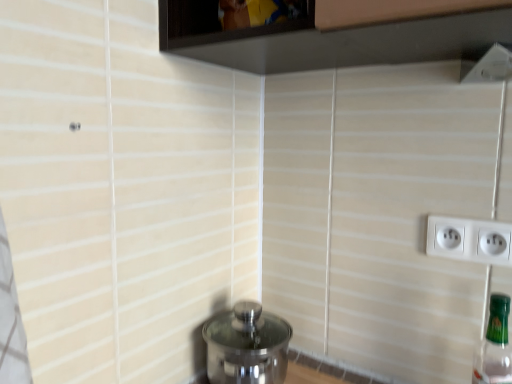
Question: From a real-world perspective, is transparent glass window at upper center beneath green glass bottle at right?

Choices:
 (A) yes
 (B) no

Answer: (B)

Question: Is transparent glass window at upper center wider than green glass bottle at right?

Choices:
 (A) yes
 (B) no

Answer: (A)

Question: Does transparent glass window at upper center appear on the left side of green glass bottle at right?

Choices:
 (A) yes
 (B) no

Answer: (A)

Question: Is transparent glass window at upper center in front of green glass bottle at right?

Choices:
 (A) yes
 (B) no

Answer: (B)

Question: Considering the relative positions of transparent glass window at upper center and green glass bottle at right in the image provided, is transparent glass window at upper center behind green glass bottle at right?

Choices:
 (A) no
 (B) yes

Answer: (B)

Question: From the image's perspective, is transparent glass window at upper center located beneath green glass bottle at right?

Choices:
 (A) yes
 (B) no

Answer: (B)

Question: From the image's perspective, would you say green glass bottle at right is shown under polished stainless steel water heater at lower center?

Choices:
 (A) no
 (B) yes

Answer: (A)

Question: Is green glass bottle at right to the left of polished stainless steel water heater at lower center from the viewer's perspective?

Choices:
 (A) no
 (B) yes

Answer: (A)

Question: Can you confirm if green glass bottle at right is smaller than polished stainless steel water heater at lower center?

Choices:
 (A) no
 (B) yes

Answer: (B)

Question: Is green glass bottle at right next to polished stainless steel water heater at lower center and touching it?

Choices:
 (A) yes
 (B) no

Answer: (B)

Question: Can you confirm if green glass bottle at right is positioned to the right of polished stainless steel water heater at lower center?

Choices:
 (A) yes
 (B) no

Answer: (A)

Question: Is green glass bottle at right closer to the viewer compared to polished stainless steel water heater at lower center?

Choices:
 (A) no
 (B) yes

Answer: (B)

Question: Considering the relative sizes of transparent glass window at upper center and polished stainless steel water heater at lower center in the image provided, is transparent glass window at upper center thinner than polished stainless steel water heater at lower center?

Choices:
 (A) no
 (B) yes

Answer: (A)